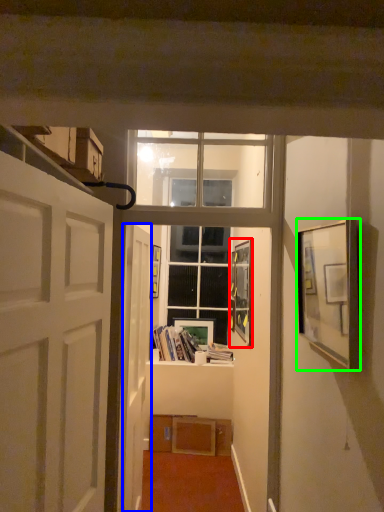
Question: Based on their relative distances, which object is farther from picture frame (highlighted by a red box)? Choose from door (highlighted by a blue box) and picture frame (highlighted by a green box).

Choices:
 (A) door
 (B) picture frame

Answer: (B)